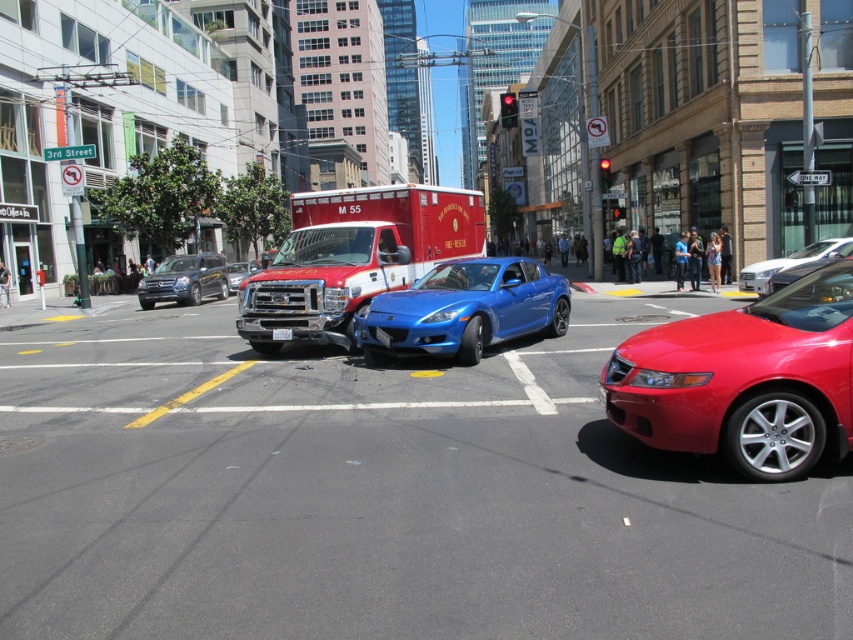
Question: Which object appears farthest from the camera in this image?

Choices:
 (A) blue glossy sports car at center
 (B) glossy red car at lower right
 (C) matte black suv at left
 (D) white plastic license plate at center

Answer: (C)

Question: Which of these objects is positioned farthest from the matte black suv at left?

Choices:
 (A) metallic silver sedan at center
 (B) white plastic license plate at center
 (C) red matte fire truck at center

Answer: (B)

Question: Is the position of red matte fire truck at center more distant than that of matte black suv at left?

Choices:
 (A) yes
 (B) no

Answer: (B)

Question: Considering the relative positions of metallic blue car at center and glossy red car at lower right in the image provided, where is metallic blue car at center located with respect to glossy red car at lower right?

Choices:
 (A) above
 (B) below

Answer: (B)

Question: Does shiny black sedan at center appear under white plastic license plate at center?

Choices:
 (A) yes
 (B) no

Answer: (B)

Question: Which point appears farthest from the camera in this image?

Choices:
 (A) (428, 618)
 (B) (328, 312)
 (C) (804, 472)
 (D) (289, 333)

Answer: (D)